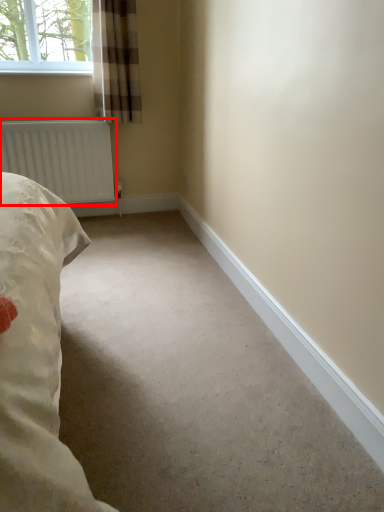
Question: Where is radiator (annotated by the red box) located in relation to curtain in the image?

Choices:
 (A) left
 (B) right

Answer: (A)